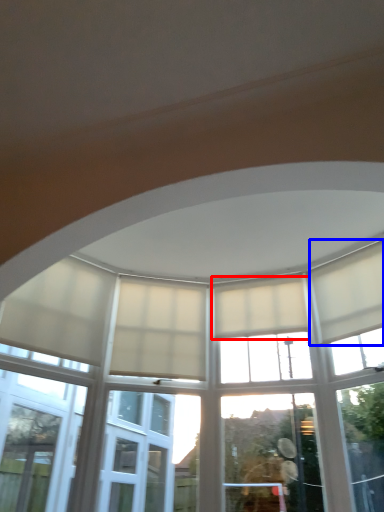
Question: Which object is further to the camera taking this photo, curtain (highlighted by a red box) or curtain (highlighted by a blue box)?

Choices:
 (A) curtain
 (B) curtain

Answer: (A)